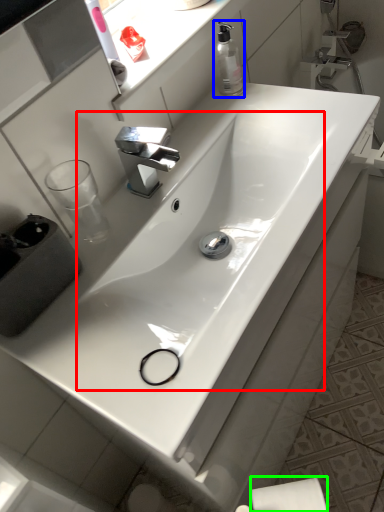
Question: Which is farther away from sink (highlighted by a red box)? soap dispenser (highlighted by a blue box) or toilet paper (highlighted by a green box)?

Choices:
 (A) soap dispenser
 (B) toilet paper

Answer: (B)